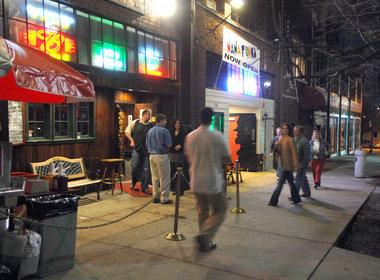
I want to click on wooden bench, so click(87, 183).